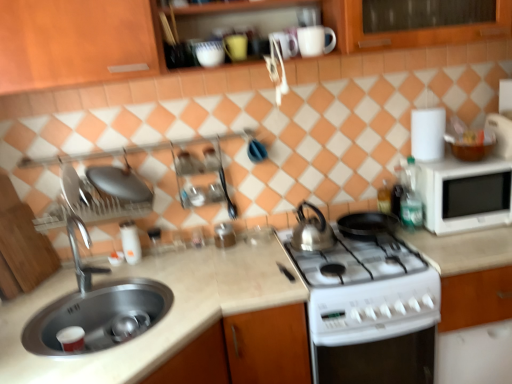
Question: Does white glossy mug at upper center, the second mug when ordered from left to right, have a lesser height compared to white matte microwave at right?

Choices:
 (A) yes
 (B) no

Answer: (A)

Question: Is white matte microwave at right completely or partially inside white glossy mug at upper center, the first mug viewed from the right?

Choices:
 (A) no
 (B) yes

Answer: (A)

Question: Does white glossy mug at upper center, the second mug when ordered from left to right, have a lesser width compared to white matte microwave at right?

Choices:
 (A) no
 (B) yes

Answer: (B)

Question: From a real-world perspective, is white glossy mug at upper center, the second mug when ordered from left to right, over white matte microwave at right?

Choices:
 (A) no
 (B) yes

Answer: (B)

Question: Is white glossy mug at upper center, the first mug viewed from the right, placed right next to white matte microwave at right?

Choices:
 (A) no
 (B) yes

Answer: (A)

Question: Is white glossy mug at upper center, the second mug when ordered from left to right, oriented towards white matte microwave at right?

Choices:
 (A) no
 (B) yes

Answer: (A)

Question: Does glossy ceramic mug at upper center, which appears as the 2th mug when viewed from the right, have a smaller size compared to white glossy salt shaker at center, the second appliance viewed from the right?

Choices:
 (A) yes
 (B) no

Answer: (A)

Question: Would you say glossy ceramic mug at upper center, which appears as the 2th mug when viewed from the right, contains white glossy salt shaker at center, the second appliance viewed from the right?

Choices:
 (A) no
 (B) yes

Answer: (A)

Question: From a real-world perspective, is glossy ceramic mug at upper center, which appears as the 2th mug when viewed from the right, beneath white glossy salt shaker at center, the second appliance viewed from the right?

Choices:
 (A) yes
 (B) no

Answer: (B)

Question: From the image's perspective, is glossy ceramic mug at upper center, which appears as the 2th mug when viewed from the right, on white glossy salt shaker at center, the second appliance viewed from the right?

Choices:
 (A) no
 (B) yes

Answer: (B)

Question: Would you say glossy ceramic mug at upper center, the 1th mug in the left-to-right sequence, is a long distance from white glossy salt shaker at center, which is the first appliance from left to right?

Choices:
 (A) no
 (B) yes

Answer: (B)

Question: Is glossy ceramic mug at upper center, the 1th mug in the left-to-right sequence, bigger than white glossy salt shaker at center, which is the first appliance from left to right?

Choices:
 (A) yes
 (B) no

Answer: (B)

Question: Is white glossy mug at upper center, the first mug viewed from the right, oriented towards white matte countertop at center?

Choices:
 (A) yes
 (B) no

Answer: (B)